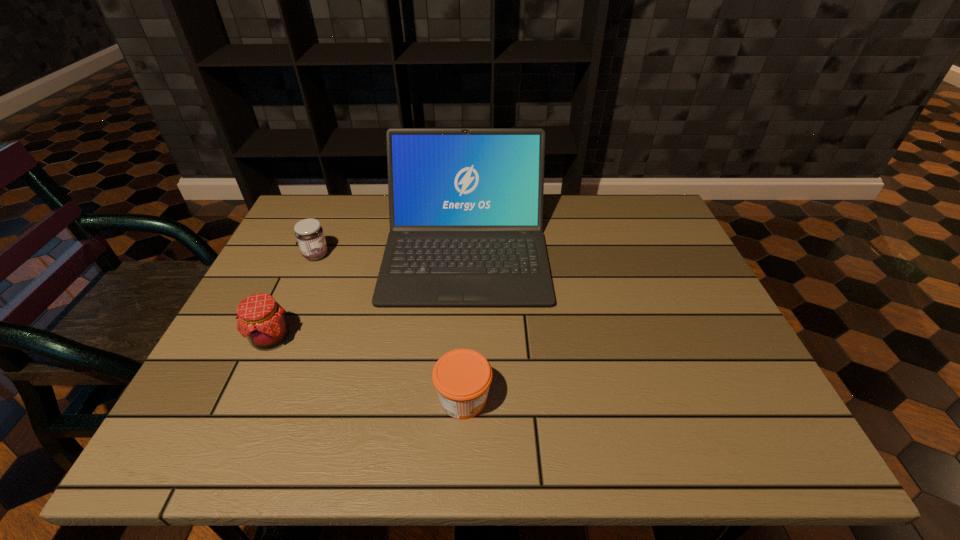
What are the coordinates of `the tallest object` in the screenshot? It's located at (465, 204).

In order to click on the second nearest object in this screenshot , I will do `click(261, 319)`.

I want to click on the farthest jam, so click(309, 234).

The width and height of the screenshot is (960, 540). In order to click on the nearest jam in this screenshot , I will do `click(462, 377)`.

Locate an element on the screen. the rightmost jam is located at coordinates (462, 377).

At what (x,y) coordinates should I click in order to perform the action: click on free space located on the screen of the laptop computer. Please return your answer as a coordinate pair (x, y). The image size is (960, 540). Looking at the image, I should click on (462, 359).

I want to click on free space located 0.310m on the back of the second nearest object, so click(x=315, y=241).

This screenshot has height=540, width=960. Find the location of `vacant space located 0.260m on the front label of the farthest jam`. vacant space located 0.260m on the front label of the farthest jam is located at coordinates (422, 255).

The width and height of the screenshot is (960, 540). Identify the location of vacant space situated on the front label of the nearest object. (631, 399).

The width and height of the screenshot is (960, 540). I want to click on object that is at the far edge, so click(465, 204).